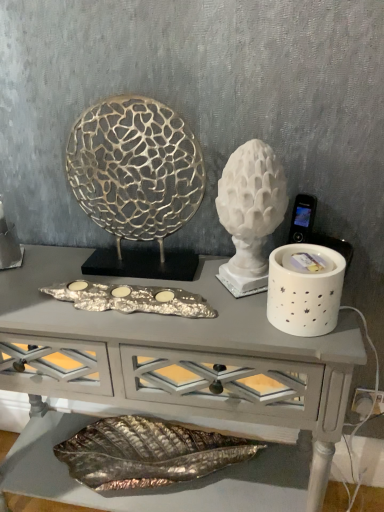
Find the location of `free space to the left of silver metallic tray at center`. free space to the left of silver metallic tray at center is located at coordinates (35, 289).